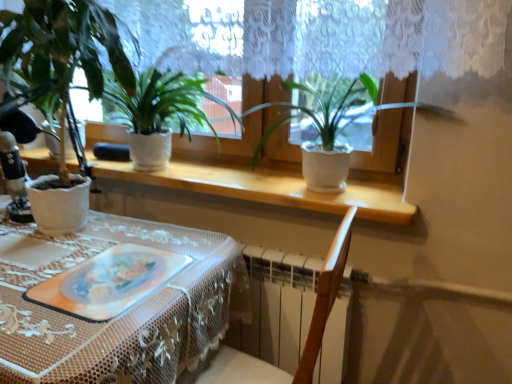
Where is `free space to the left of translucent plastic platter at center`? This screenshot has height=384, width=512. free space to the left of translucent plastic platter at center is located at coordinates (36, 263).